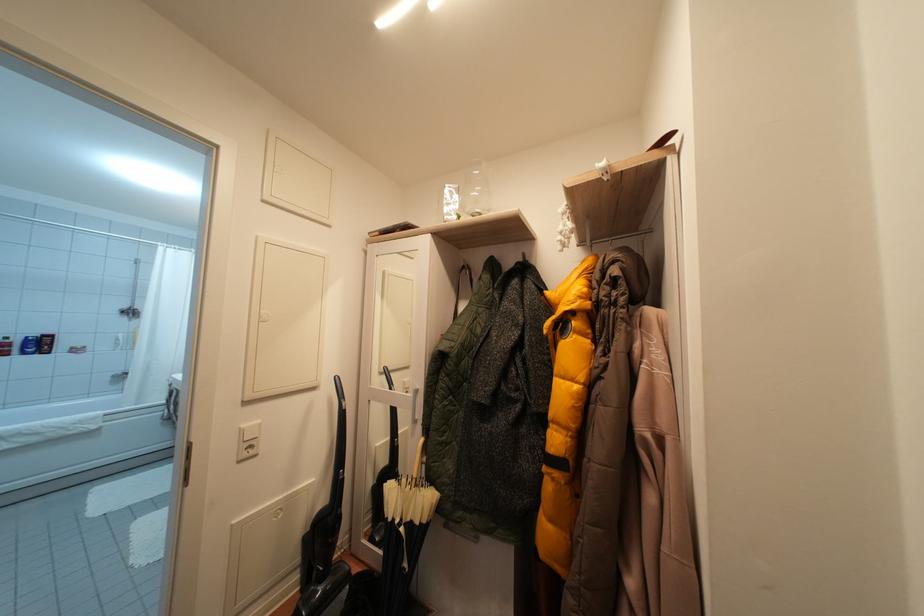
Which object does [602,169] point to?

This point indicates the white cat figurine.